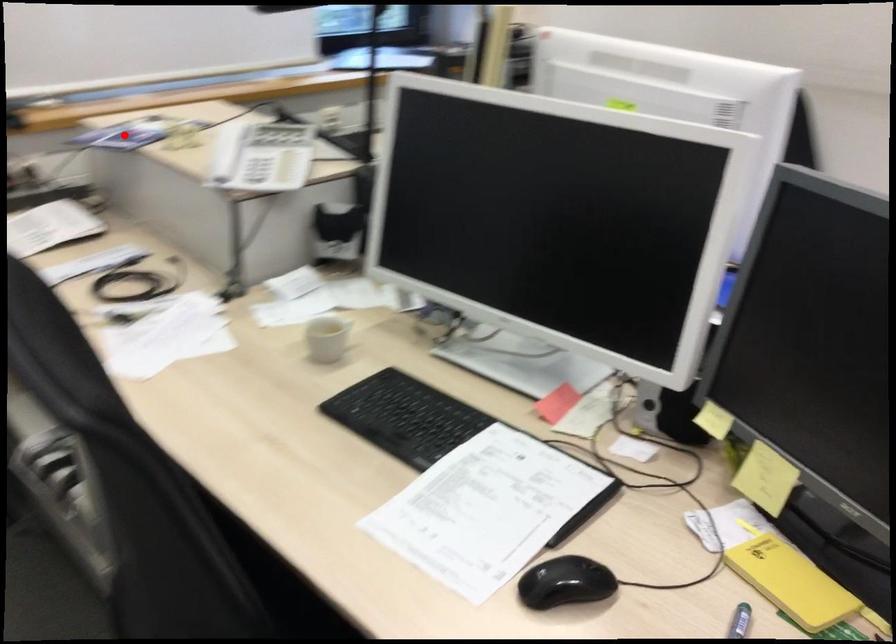
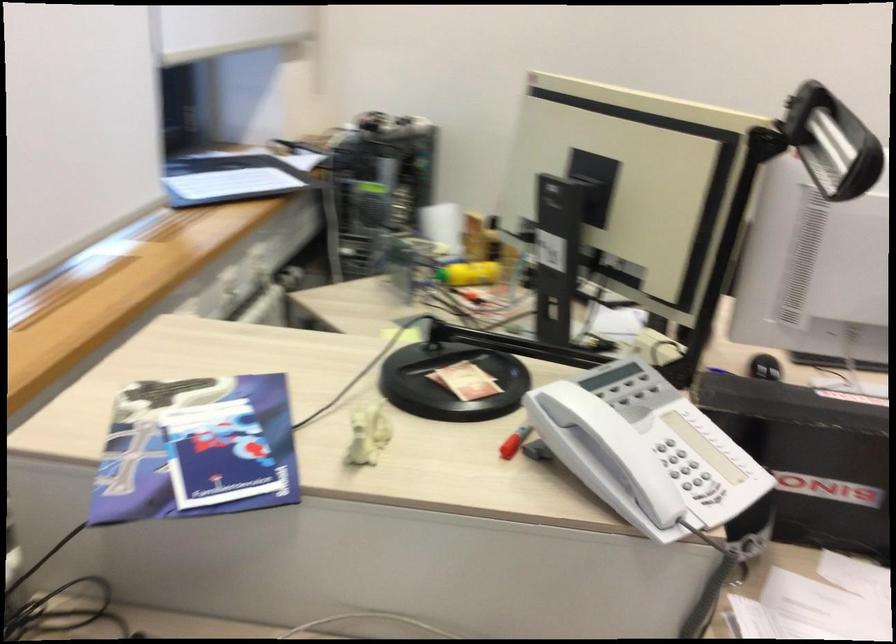
The point at the highlighted location is marked in the first image. Where is the corresponding point in the second image?

(195, 450)